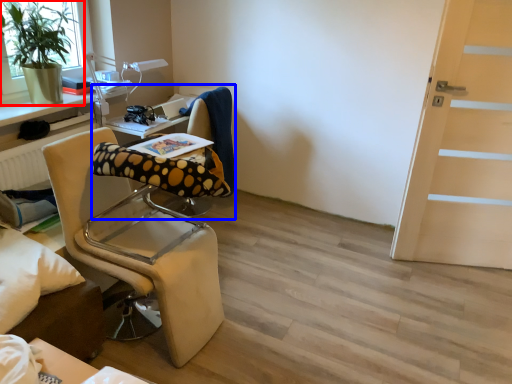
Question: Which object appears farthest to the camera in this image, houseplant (highlighted by a red box) or computer chair (highlighted by a blue box)?

Choices:
 (A) houseplant
 (B) computer chair

Answer: (B)